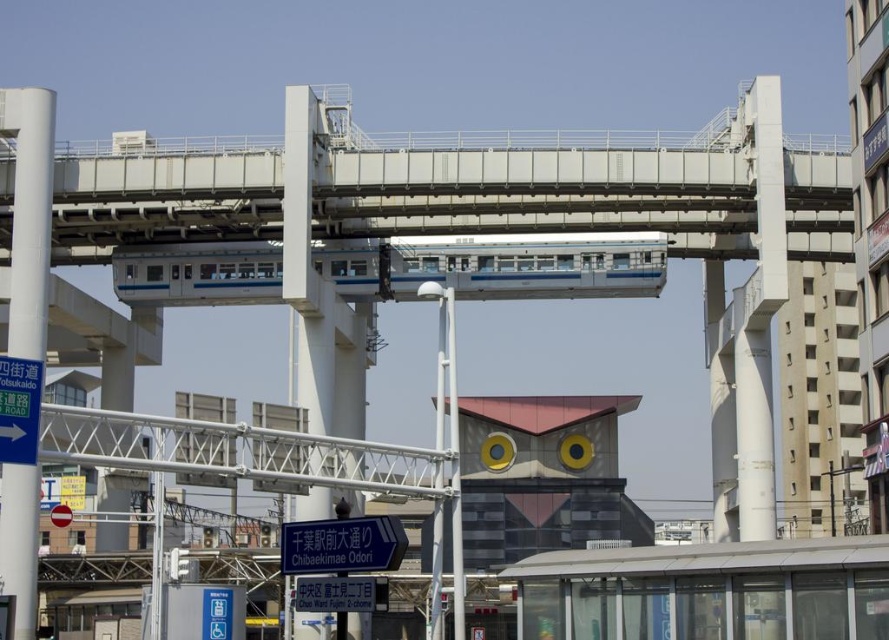
You are a drone operator trying to navigate between two points in the urban scene. The first point is point [17,92] and the second is point [301,540]. Which point is closer to you as you fly over the city?

Point [17,92] is closer to you than point [301,540] because it is further to the viewer, meaning it is physically nearer in the three dimensional space.

You are standing at the point marked by the coordinates point (542, 193) in the urban scene. What structure are you directly under?

The point (542, 193) marks the white metallic overpass at center, so you are directly under the white metallic overpass at center.

You are a city planner analyzing the urban layout. The white metallic overpass at center and the white glossy pole at left are both part of the monorail infrastructure. Based on their sizes, which one would require more materials to construct?

The white metallic overpass at center requires more materials to construct because its width is larger than the white glossy pole at left, indicating it has a greater overall size.